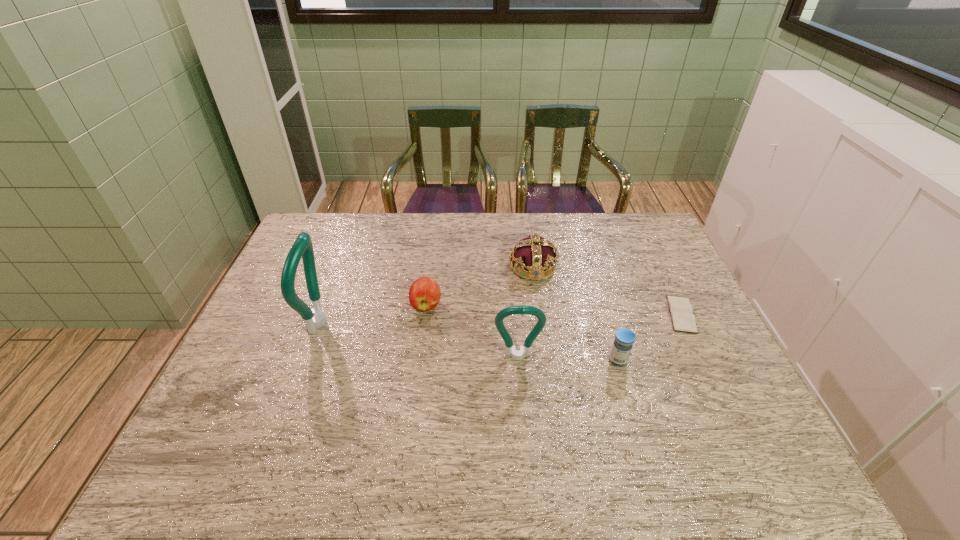
Locate an element on the screen. This screenshot has width=960, height=540. blank region between the medicine and the diary is located at coordinates (649, 338).

The width and height of the screenshot is (960, 540). In order to click on free point between the second object from left to right and the diary in this screenshot , I will do `click(554, 310)`.

Where is `object identified as the fifth closest to the farthest object`? The width and height of the screenshot is (960, 540). object identified as the fifth closest to the farthest object is located at coordinates (315, 318).

Locate which object ranks third in proximity to the apple. Please provide its 2D coordinates. Your answer should be formatted as a tuple, i.e. [(x, y)], where the tuple contains the x and y coordinates of a point satisfying the conditions above.

[(315, 318)]

Where is `free location that satisfies the following two spatial constraints: 1. at the jaws of the medicine; 2. on the right side of the fifth shortest object`? This screenshot has height=540, width=960. free location that satisfies the following two spatial constraints: 1. at the jaws of the medicine; 2. on the right side of the fifth shortest object is located at coordinates (518, 361).

At what (x,y) coordinates should I click in order to perform the action: click on free space that satisfies the following two spatial constraints: 1. at the jaws of the leftmost object; 2. on the back side of the medicine. Please return your answer as a coordinate pair (x, y). The width and height of the screenshot is (960, 540). Looking at the image, I should click on (306, 361).

At what (x,y) coordinates should I click in order to perform the action: click on free space that satisfies the following two spatial constraints: 1. on the front side of the second object from left to right; 2. on the right side of the shortest object. Please return your answer as a coordinate pair (x, y). The image size is (960, 540). Looking at the image, I should click on (425, 314).